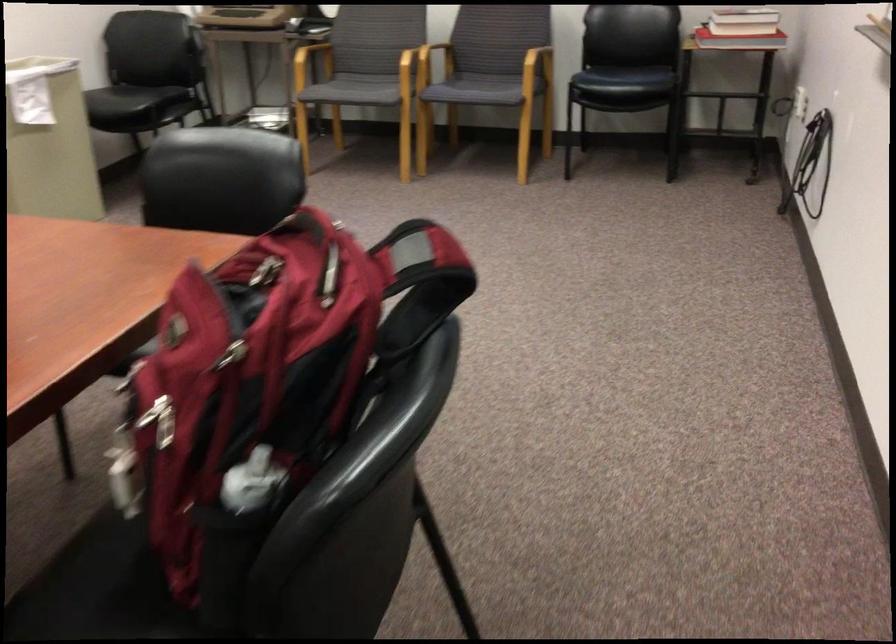
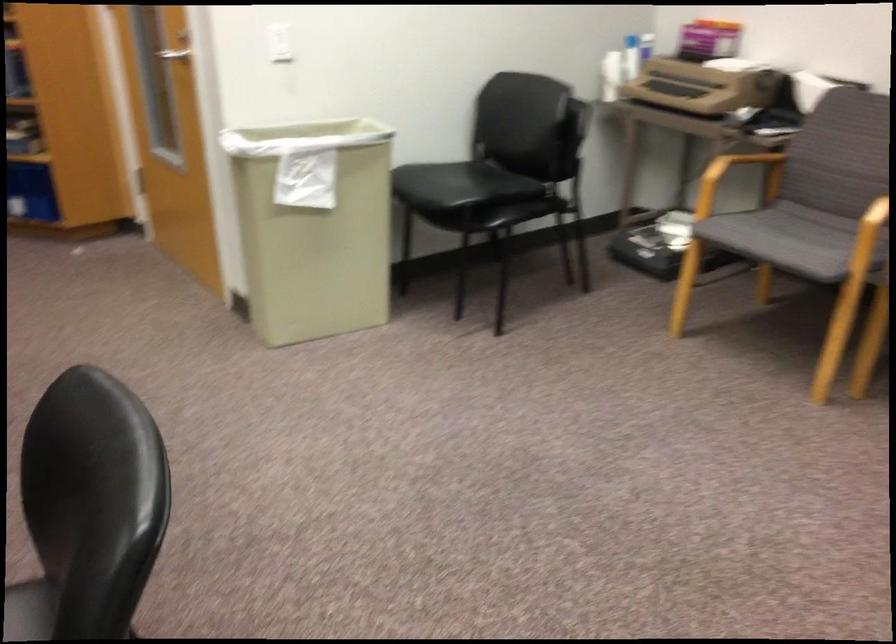
The point at (363,79) is marked in the first image. Where is the corresponding point in the second image?

(789, 243)